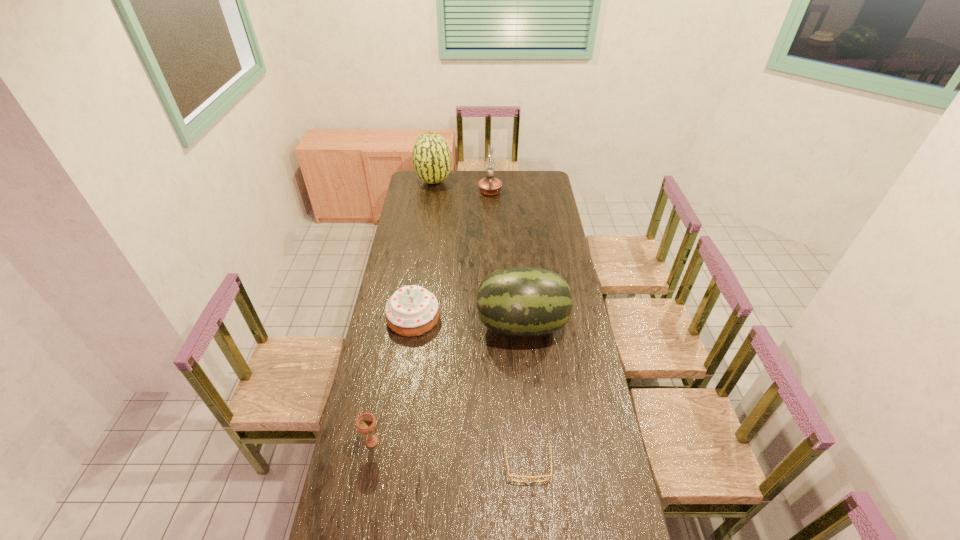
You are a GUI agent. You are given a task and a screenshot of the screen. Output one action in this format:
    pyautogui.click(x=<x>, y=<y>)
    Task: Click on the left watermelon
    The image size is (960, 540).
    Given the screenshot: What is the action you would take?
    pyautogui.click(x=431, y=156)

Locate an element on the screen. The image size is (960, 540). oil lamp is located at coordinates (489, 186).

You are a GUI agent. You are given a task and a screenshot of the screen. Output one action in this format:
    pyautogui.click(x=<x>, y=<y>)
    Task: Click on the nearer watermelon
    This screenshot has width=960, height=540.
    Given the screenshot: What is the action you would take?
    pyautogui.click(x=524, y=302)

This screenshot has width=960, height=540. In order to click on cake in this screenshot , I will do `click(412, 310)`.

This screenshot has width=960, height=540. Find the location of `chalice`. chalice is located at coordinates (366, 423).

This screenshot has width=960, height=540. I want to click on spectacles, so click(528, 477).

Identify the location of blank space located 0.090m on the right of the farther watermelon. (466, 181).

Where is `blank area located on the front of the oil lamp`? The height and width of the screenshot is (540, 960). blank area located on the front of the oil lamp is located at coordinates (491, 223).

Locate an element on the screen. blank space located 0.060m on the front of the nearer watermelon is located at coordinates (525, 364).

I want to click on free spot located on the back of the cake, so click(x=420, y=270).